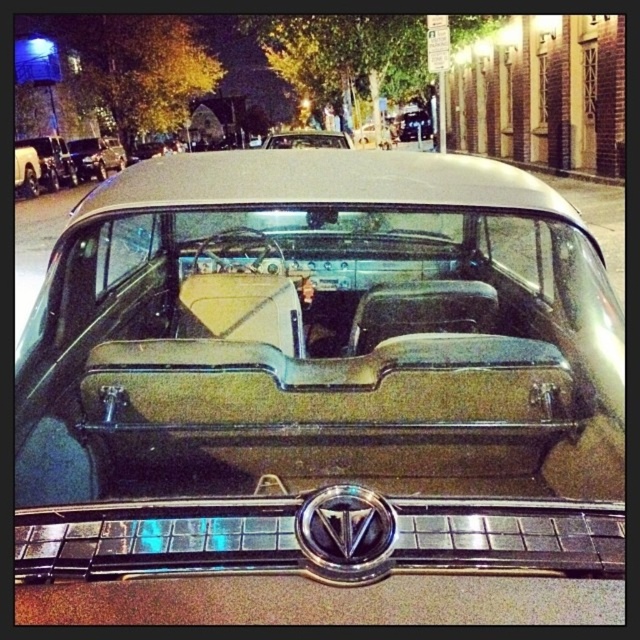
You are a photographer setting up a tripod to capture the metallic tan car at center and the shiny beige leather car at center. Since you want to ensure both cars are fully visible in the frame, which car should you position closer to the edge of the frame to avoid overcrowding?

You should position the metallic tan car at center closer to the edge of the frame because it occupies less space than the shiny beige leather car at center, allowing more room for the larger car in the center.

You are standing 1.5 meters away from the vintage car. Can you reach the point at coordinates point (586, 524) without moving closer to the car?

The point at coordinates point (586, 524) is 1.28 meters away from the viewer. Since you are currently standing 1.5 meters away from the car, you cannot reach it without moving closer.